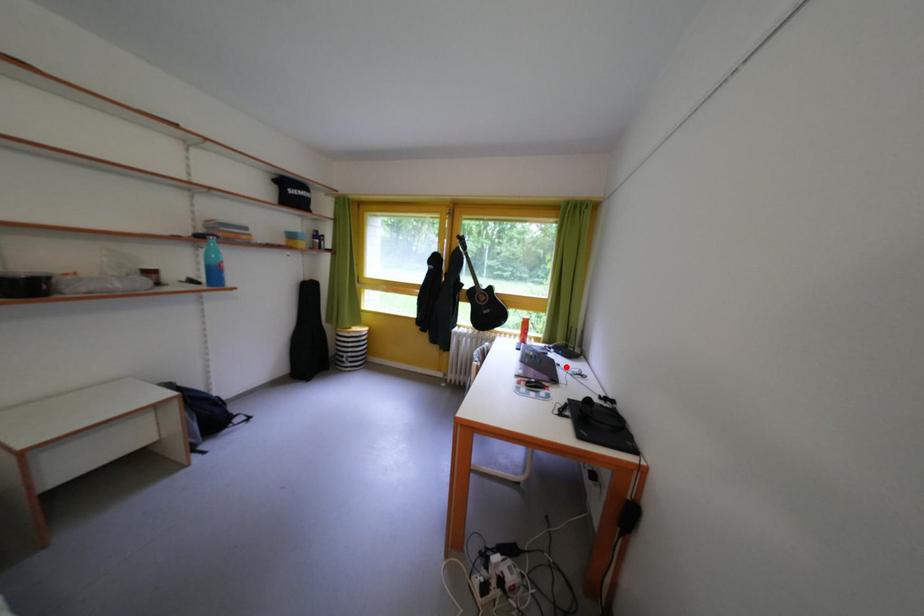
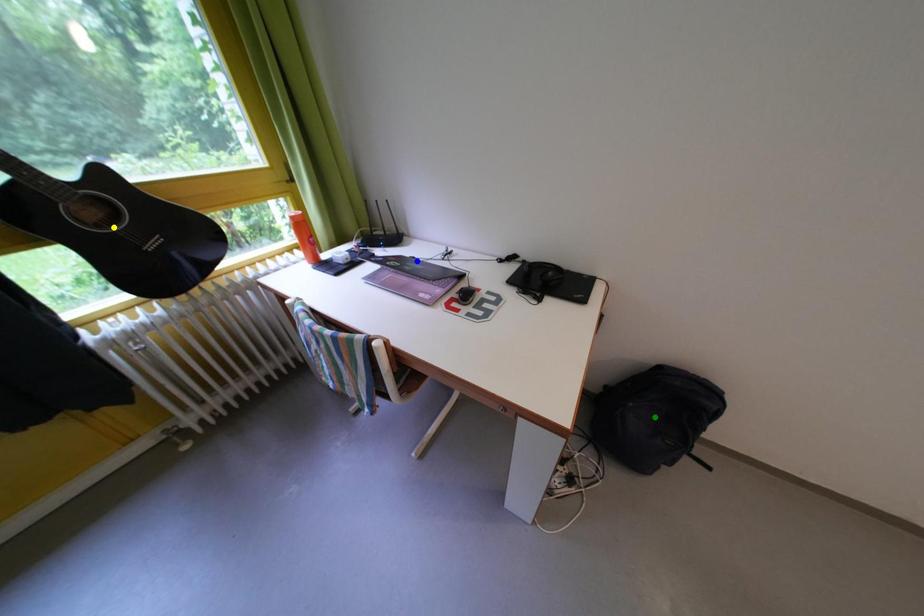
Question: I am providing you with two images of the same scene from different viewpoints. A red point is marked on the first image. You are given multiple points on the second image. Can you choose the point in image 2 that corresponds to the point in image 1?

Choices:
 (A) blue point
 (B) green point
 (C) yellow point

Answer: (A)